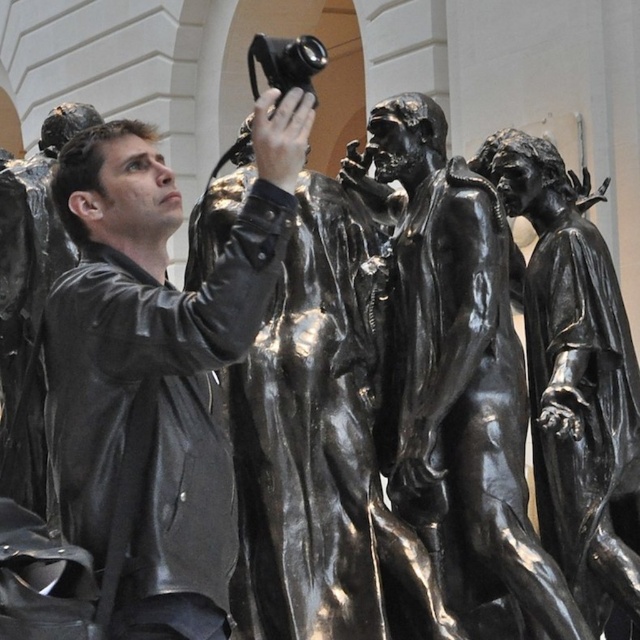
The height and width of the screenshot is (640, 640). Describe the element at coordinates (460, 385) in the screenshot. I see `black polished bronze figures at center` at that location.

Who is taller, black polished bronze figures at center or bronze statue at center?

With more height is black polished bronze figures at center.

Find the location of a particular element. This screenshot has height=640, width=640. black polished bronze figures at center is located at coordinates (460, 385).

Locate an element on the screen. black polished bronze figures at center is located at coordinates (460, 385).

Does shiny bronze statue at center appear over bronze statue at center?

No.

Where is `shiny bronze statue at center`? shiny bronze statue at center is located at coordinates (576, 378).

This screenshot has height=640, width=640. I want to click on shiny bronze statue at center, so click(x=576, y=378).

What are the coordinates of `shiny bronze statue at center` in the screenshot? It's located at click(576, 378).

Does black leather jacket at center lie in front of shiny bronze statue at center?

Yes, it is in front of shiny bronze statue at center.

Does black leather jacket at center appear under shiny bronze statue at center?

No, black leather jacket at center is not below shiny bronze statue at center.

The width and height of the screenshot is (640, 640). What do you see at coordinates (157, 362) in the screenshot?
I see `black leather jacket at center` at bounding box center [157, 362].

At what (x,y) coordinates should I click in order to perform the action: click on black leather jacket at center. Please return your answer as a coordinate pair (x, y). The image size is (640, 640). Looking at the image, I should click on (157, 362).